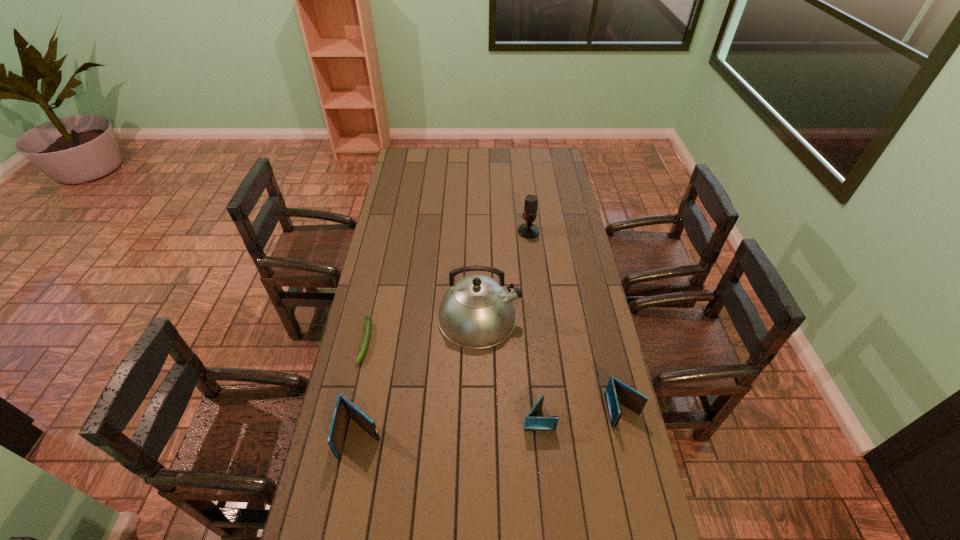
Where is `vacant space that is in between the fifth shortest object and the second wallet from left to right`? vacant space that is in between the fifth shortest object and the second wallet from left to right is located at coordinates (534, 325).

You are a GUI agent. You are given a task and a screenshot of the screen. Output one action in this format:
    pyautogui.click(x=<x>, y=<y>)
    Task: Click on the free area in between the shortest object and the second shortest wallet
    
    Given the screenshot: What is the action you would take?
    pyautogui.click(x=494, y=376)

At what (x,y) coordinates should I click in order to perform the action: click on free point between the tallest wallet and the kettle. Please return your answer as a coordinate pair (x, y). Looking at the image, I should click on (420, 376).

Locate an element on the screen. The height and width of the screenshot is (540, 960). vacant space in between the shortest object and the farthest object is located at coordinates (447, 287).

Image resolution: width=960 pixels, height=540 pixels. I want to click on unoccupied position between the tallest wallet and the second shortest wallet, so click(492, 423).

Identify the location of free space between the rightmost object and the kettle. This screenshot has width=960, height=540. point(551,363).

You are a GUI agent. You are given a task and a screenshot of the screen. Output one action in this format:
    pyautogui.click(x=<x>, y=<y>)
    Task: Click on the object that is the second nearest to the shortest object
    
    Given the screenshot: What is the action you would take?
    pyautogui.click(x=477, y=311)

Identify the location of the fifth closest object to the tallest object. (617, 392).

Select which wallet is the closest to the kettle. Please provide its 2D coordinates. Your answer should be formatted as a tuple, i.e. [(x, y)], where the tuple contains the x and y coordinates of a point satisfying the conditions above.

[(532, 423)]

Locate an element on the screen. wallet that stands as the second closest to the tallest object is located at coordinates (344, 407).